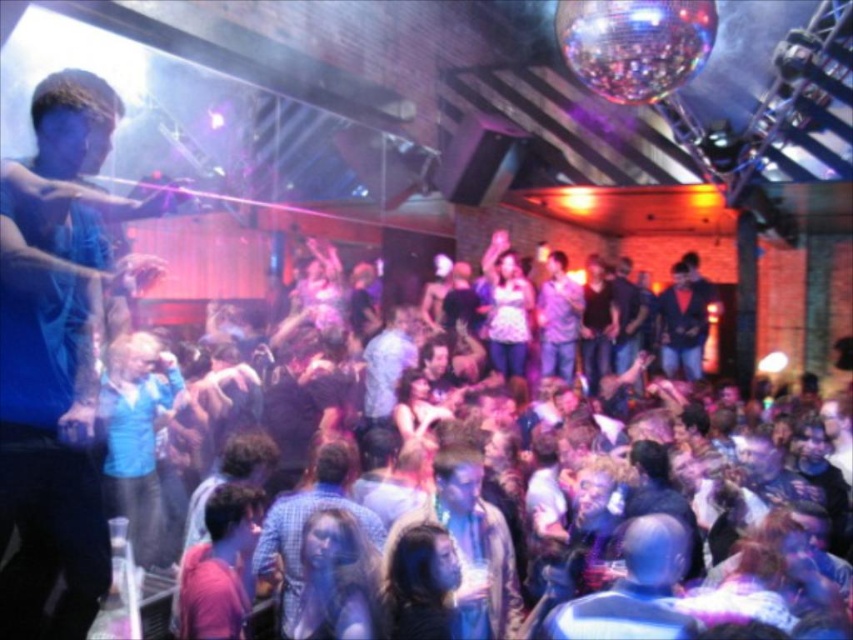
You are a photographer at the nightclub and want to capture a clear photo of both the light brown hair at center and the shiny blue suit at center. Since the lighting is very bright, you decide to adjust your camera settings. Considering the height difference between them, which object should you focus on first to ensure both are in frame?

The light brown hair at center is shorter than the shiny blue suit at center. To ensure both are in frame, focus on the shiny blue suit at center first as it is taller, allowing the shorter light brown hair at center to naturally fall within the camera frame.